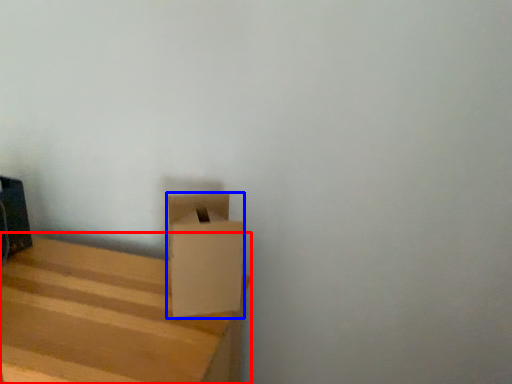
Question: Among these objects, which one is farthest to the camera, furniture (highlighted by a red box) or cardboard box (highlighted by a blue box)?

Choices:
 (A) furniture
 (B) cardboard box

Answer: (B)